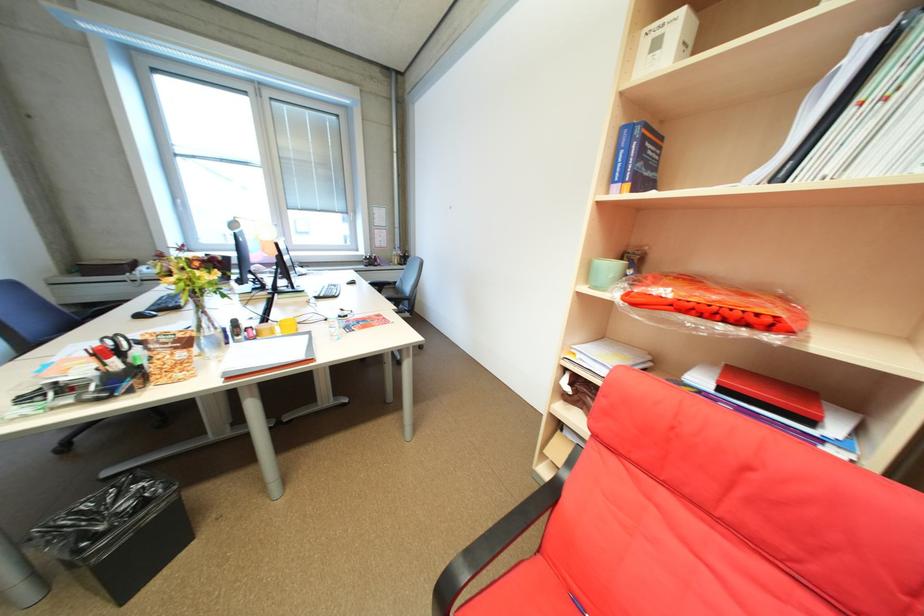
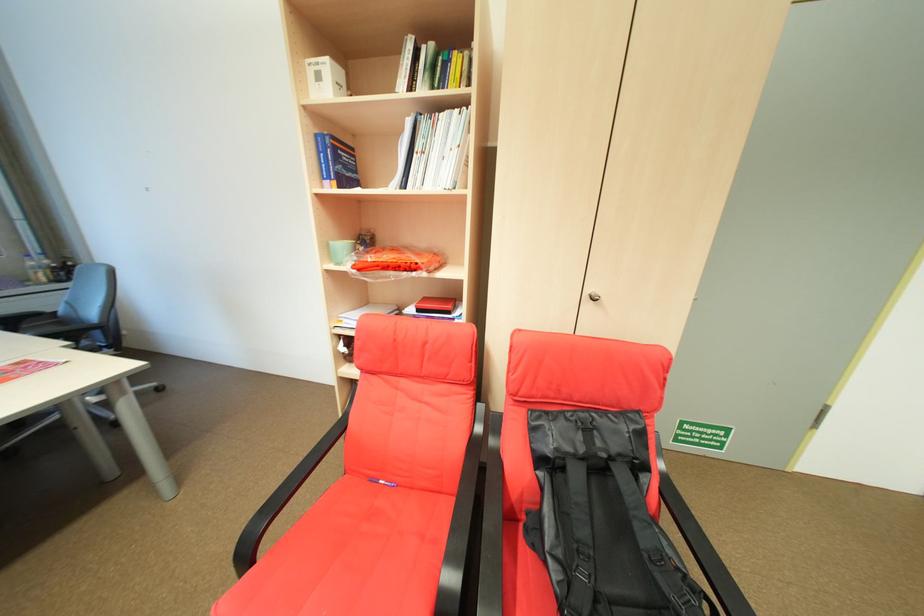
In the second image, find the point that corresponds to point 651,140 in the first image.

(344, 148)